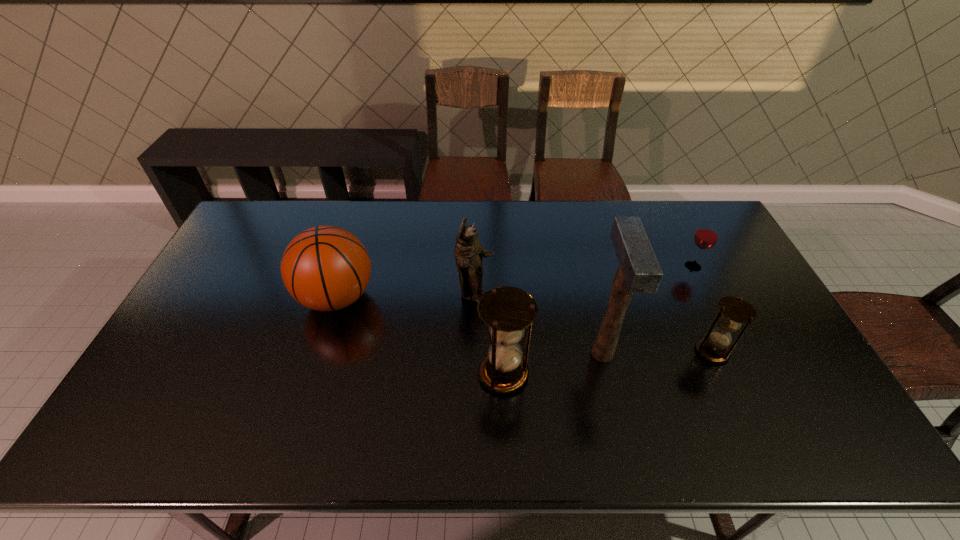
Identify the location of free point located on the front of the glass. pos(749,379).

Image resolution: width=960 pixels, height=540 pixels. What are the coordinates of `vacant space located on the front-facing side of the figurine` in the screenshot? It's located at (545, 294).

Find the location of `free space located on the back of the mallet`. free space located on the back of the mallet is located at coordinates (592, 313).

The image size is (960, 540). Identify the location of hourglass that is at the near edge. (507, 311).

Where is `mallet at the near edge`? This screenshot has height=540, width=960. mallet at the near edge is located at coordinates (638, 272).

At what (x,y) coordinates should I click in order to perform the action: click on object at the right edge. Please return your answer as a coordinate pair (x, y). The width and height of the screenshot is (960, 540). Looking at the image, I should click on click(x=706, y=236).

Identify the location of vacant space at the far edge of the desktop. (439, 226).

This screenshot has height=540, width=960. In the image, there is a desktop. Find the location of `vacant space at the near edge`. vacant space at the near edge is located at coordinates (383, 408).

In the image, there is a desktop. Find the location of `vacant space at the left edge`. vacant space at the left edge is located at coordinates (225, 286).

I want to click on vacant space at the far left corner of the desktop, so click(254, 214).